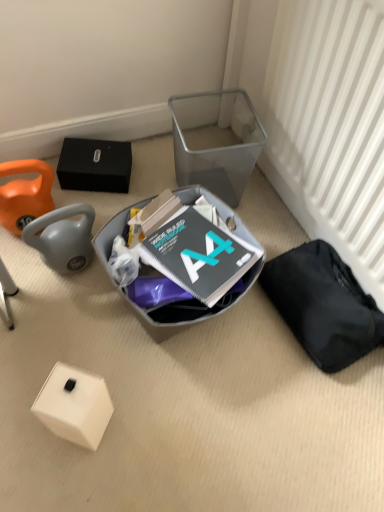
Question: In which direction should I rotate to look at matte gray plastic bin at center, which appears as the second waste when viewed from the right?

Choices:
 (A) left
 (B) right

Answer: (A)

Question: Is transparent plastic shoe box at upper right touching white matte box at lower left?

Choices:
 (A) no
 (B) yes

Answer: (A)

Question: Considering the relative sizes of transparent plastic shoe box at upper right and white matte box at lower left in the image provided, is transparent plastic shoe box at upper right shorter than white matte box at lower left?

Choices:
 (A) no
 (B) yes

Answer: (A)

Question: Is transparent plastic shoe box at upper right in front of white matte box at lower left?

Choices:
 (A) no
 (B) yes

Answer: (A)

Question: Is transparent plastic shoe box at upper right facing away from white matte box at lower left?

Choices:
 (A) yes
 (B) no

Answer: (B)

Question: From a real-world perspective, is transparent plastic shoe box at upper right on top of white matte box at lower left?

Choices:
 (A) no
 (B) yes

Answer: (B)

Question: Considering the relative positions of transparent plastic shoe box at upper right and white matte box at lower left in the image provided, is transparent plastic shoe box at upper right behind white matte box at lower left?

Choices:
 (A) yes
 (B) no

Answer: (A)

Question: Does white textured radiator at right appear on the left side of white matte box at lower left?

Choices:
 (A) no
 (B) yes

Answer: (A)

Question: Is white textured radiator at right smaller than white matte box at lower left?

Choices:
 (A) yes
 (B) no

Answer: (B)

Question: Does white textured radiator at right have a greater height compared to white matte box at lower left?

Choices:
 (A) no
 (B) yes

Answer: (B)

Question: Does white textured radiator at right come behind white matte box at lower left?

Choices:
 (A) no
 (B) yes

Answer: (A)

Question: Is white textured radiator at right looking in the opposite direction of white matte box at lower left?

Choices:
 (A) no
 (B) yes

Answer: (A)

Question: Can white matte box at lower left be found inside white textured radiator at right?

Choices:
 (A) yes
 (B) no

Answer: (B)

Question: From a real-world perspective, does matte gray plastic bin at center, which appears as the second waste when viewed from the right, stand above black fabric bag at lower right, acting as the 1th waste starting from the right?

Choices:
 (A) no
 (B) yes

Answer: (B)